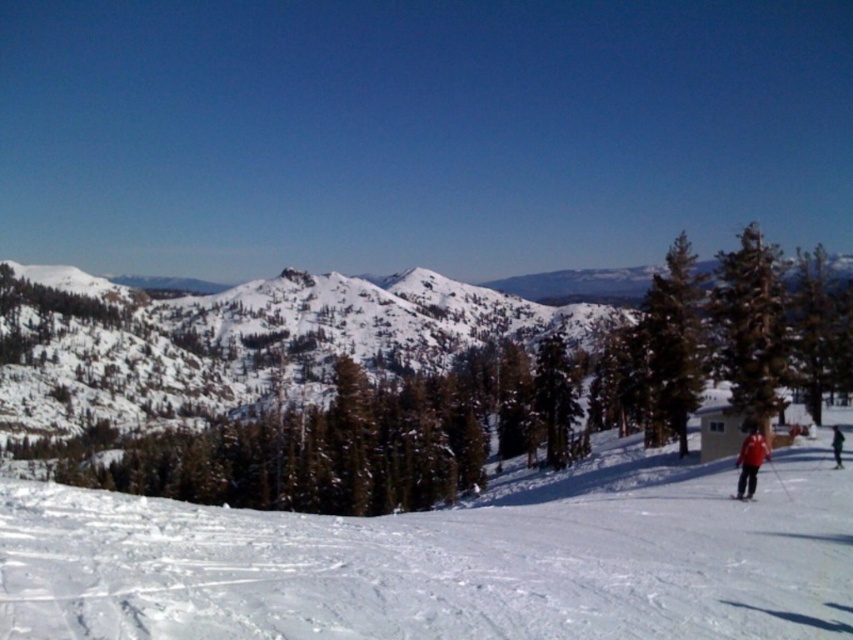
You are a photographer planning to take a photo of the red matte skier at lower right and the dark blue jacket at lower right. Which one will be closer to the camera in the photo?

The red matte skier at lower right is in front of dark blue jacket at lower right, so it will be closer to the camera in the photo.

You are a photographer planning to take a photo of the red matte skier at lower right and the dark blue jacket at lower right. Which object should you focus on first if you want to ensure both are in sharp focus?

The red matte skier at lower right is bigger than the dark blue jacket at lower right, so you should focus on the red matte skier at lower right first to ensure both are in sharp focus.